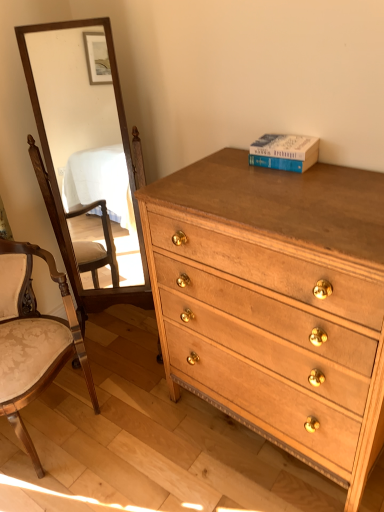
This screenshot has width=384, height=512. Describe the element at coordinates (33, 338) in the screenshot. I see `wooden upholstered chair at left` at that location.

Find the location of a particular element. The height and width of the screenshot is (512, 384). wooden mirror at left is located at coordinates (85, 137).

Is wooden mirror at left at the back of light brown wood chest of drawers at center?

No, light brown wood chest of drawers at center's orientation is not away from wooden mirror at left.

Considering the sizes of light brown wood chest of drawers at center and wooden mirror at left in the image, is light brown wood chest of drawers at center wider or thinner than wooden mirror at left?

light brown wood chest of drawers at center is wider than wooden mirror at left.

From the image's perspective, between light brown wood chest of drawers at center and wooden mirror at left, which one is located above?

wooden mirror at left.

In the image, is light brown wood chest of drawers at center positioned in front of or behind blue hardcover book at upper right?

Visually, light brown wood chest of drawers at center is located in front of blue hardcover book at upper right.

From the image's perspective, is light brown wood chest of drawers at center above blue hardcover book at upper right?

No.

Considering the sizes of light brown wood chest of drawers at center and blue hardcover book at upper right in the image, is light brown wood chest of drawers at center bigger or smaller than blue hardcover book at upper right?

Considering their sizes, light brown wood chest of drawers at center takes up more space than blue hardcover book at upper right.

Considering the sizes of objects light brown wood chest of drawers at center and blue hardcover book at upper right in the image provided, who is wider, light brown wood chest of drawers at center or blue hardcover book at upper right?

With larger width is light brown wood chest of drawers at center.

From a real-world perspective, is wooden mirror at left positioned over light brown wood chest of drawers at center based on gravity?

Yes, from a real-world perspective, wooden mirror at left is on top of light brown wood chest of drawers at center.

Based on the photo, relative to light brown wood chest of drawers at center, is wooden mirror at left in front or behind?

wooden mirror at left is positioned farther from the viewer than light brown wood chest of drawers at center.

Are wooden mirror at left and light brown wood chest of drawers at center far apart?

Absolutely, wooden mirror at left is distant from light brown wood chest of drawers at center.

Is wooden upholstered chair at left facing away from wooden mirror at left?

That's not correct — wooden upholstered chair at left is not looking away from wooden mirror at left.

Is wooden upholstered chair at left not close to wooden mirror at left?

That's right, there is a large distance between wooden upholstered chair at left and wooden mirror at left.

Visually, is wooden upholstered chair at left positioned to the left or to the right of wooden mirror at left?

wooden upholstered chair at left is positioned on wooden mirror at left's left side.

Which object is closer to the camera, wooden upholstered chair at left or wooden mirror at left?

wooden upholstered chair at left is in front.

Does wooden upholstered chair at left turn towards blue hardcover book at upper right?

No, wooden upholstered chair at left is not turned towards blue hardcover book at upper right.

Which is behind, wooden upholstered chair at left or blue hardcover book at upper right?

blue hardcover book at upper right is more distant.

Looking at this image, which object is thinner, blue hardcover book at upper right or wooden upholstered chair at left?

With smaller width is blue hardcover book at upper right.

Are blue hardcover book at upper right and wooden upholstered chair at left beside each other?

No, blue hardcover book at upper right is not beside wooden upholstered chair at left.

Can you confirm if blue hardcover book at upper right is taller than wooden upholstered chair at left?

In fact, blue hardcover book at upper right may be shorter than wooden upholstered chair at left.

From the picture: What's the angular difference between wooden upholstered chair at left and light brown wood chest of drawers at center's facing directions?

wooden upholstered chair at left and light brown wood chest of drawers at center are facing 71.9 degrees away from each other.

Could you measure the distance between wooden upholstered chair at left and light brown wood chest of drawers at center?

wooden upholstered chair at left and light brown wood chest of drawers at center are 66.63 centimeters apart from each other.

Is wooden upholstered chair at left far away from light brown wood chest of drawers at center?

They are positioned close to each other.

Which of these two, wooden upholstered chair at left or light brown wood chest of drawers at center, stands taller?

light brown wood chest of drawers at center is taller.

Identify the location of chest of drawers that appears on the right of wooden mirror at left. (275, 303).

Locate an element on the screen. This screenshot has width=384, height=512. book above the light brown wood chest of drawers at center (from a real-world perspective) is located at coordinates (284, 152).

Which object lies nearer to the anchor point light brown wood chest of drawers at center, wooden mirror at left or blue hardcover book at upper right?

Based on the image, blue hardcover book at upper right appears to be nearer to light brown wood chest of drawers at center.

From the image, which object appears to be farther from blue hardcover book at upper right, light brown wood chest of drawers at center or wooden mirror at left?

wooden mirror at left is positioned further to the anchor blue hardcover book at upper right.

Looking at the image, which one is located closer to light brown wood chest of drawers at center, wooden upholstered chair at left or wooden mirror at left?

wooden upholstered chair at left is closer to light brown wood chest of drawers at center.

Looking at the image, which one is located closer to light brown wood chest of drawers at center, blue hardcover book at upper right or wooden upholstered chair at left?

blue hardcover book at upper right.

Consider the image. When comparing their distances from blue hardcover book at upper right, does wooden upholstered chair at left or light brown wood chest of drawers at center seem further?

Among the two, wooden upholstered chair at left is located further to blue hardcover book at upper right.

From the image, which object appears to be nearer to wooden upholstered chair at left, wooden mirror at left or light brown wood chest of drawers at center?

light brown wood chest of drawers at center is positioned closer to the anchor wooden upholstered chair at left.

Which object lies further to the anchor point wooden mirror at left, wooden upholstered chair at left or blue hardcover book at upper right?

blue hardcover book at upper right lies further to wooden mirror at left than the other object.

When comparing their distances from blue hardcover book at upper right, does light brown wood chest of drawers at center or wooden upholstered chair at left seem closer?

light brown wood chest of drawers at center is closer to blue hardcover book at upper right.

Identify the location of book between wooden upholstered chair at left and light brown wood chest of drawers at center from left to right. Image resolution: width=384 pixels, height=512 pixels. (284, 152).

Where is `book situated between wooden mirror at left and light brown wood chest of drawers at center from left to right`? The height and width of the screenshot is (512, 384). book situated between wooden mirror at left and light brown wood chest of drawers at center from left to right is located at coordinates (284, 152).

You are a GUI agent. You are given a task and a screenshot of the screen. Output one action in this format:
    pyautogui.click(x=<x>, y=<y>)
    Task: Click on the mirror situated between wooden upholstered chair at left and light brown wood chest of drawers at center from left to right
    The width and height of the screenshot is (384, 512).
    Given the screenshot: What is the action you would take?
    pyautogui.click(x=85, y=137)

Locate an element on the screen. The width and height of the screenshot is (384, 512). mirror between wooden upholstered chair at left and blue hardcover book at upper right in the horizontal direction is located at coordinates (85, 137).